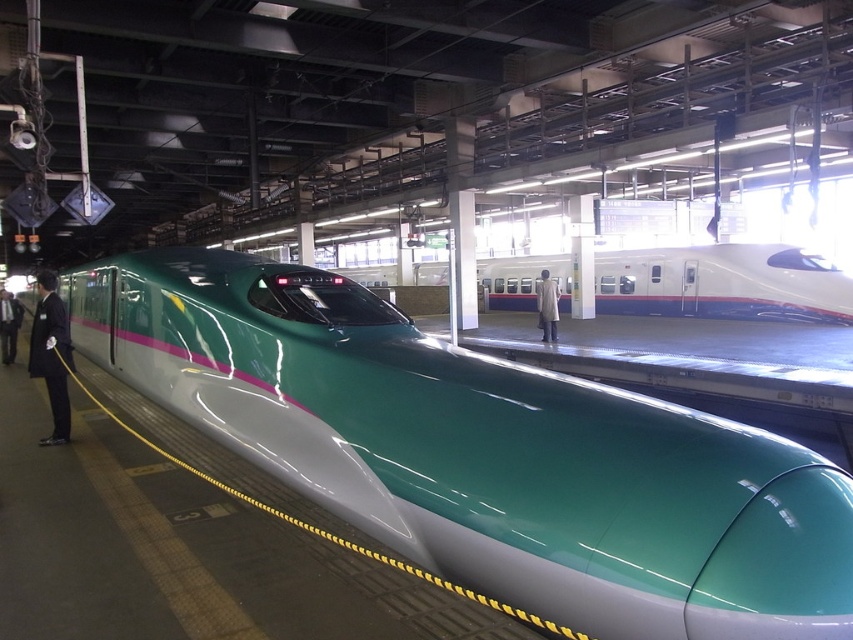
Question: Is dark suit at left above light gray coat at center?

Choices:
 (A) yes
 (B) no

Answer: (B)

Question: Can you confirm if teal glossy train at center is positioned below black suit at left?

Choices:
 (A) no
 (B) yes

Answer: (A)

Question: Considering the relative positions of teal glossy train at center and black suit at left in the image provided, where is teal glossy train at center located with respect to black suit at left?

Choices:
 (A) left
 (B) right

Answer: (B)

Question: Which object is the farthest from the black suit at left?

Choices:
 (A) light gray coat at center
 (B) dark suit at left
 (C) teal glossy train at center

Answer: (C)

Question: Which is farther from the teal glossy train at center?

Choices:
 (A) light gray coat at center
 (B) dark suit at left
 (C) black suit at left

Answer: (C)

Question: Which object appears closest to the camera in this image?

Choices:
 (A) black suit at left
 (B) light gray coat at center
 (C) dark suit at left
 (D) teal glossy train at center

Answer: (A)